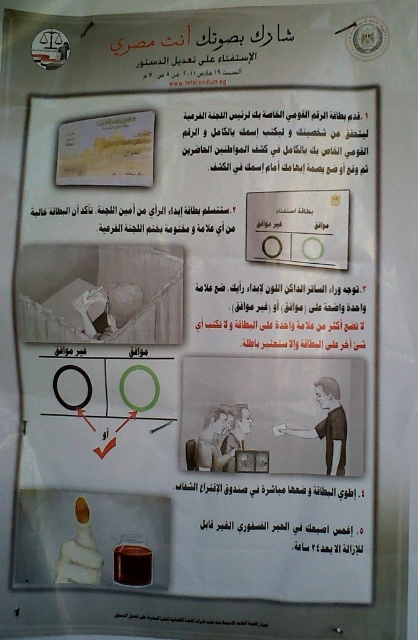
Question: Is matte white text at upper center to the left of black paper at upper left from the viewer's perspective?

Choices:
 (A) no
 (B) yes

Answer: (A)

Question: Is black paper at lower center thinner than black paper at upper left?

Choices:
 (A) no
 (B) yes

Answer: (B)

Question: Which object appears farthest from the camera in this image?

Choices:
 (A) white paper at upper center
 (B) black paper at center

Answer: (A)

Question: Is matte white text at upper center closer to the viewer compared to black paper at center?

Choices:
 (A) yes
 (B) no

Answer: (B)

Question: Estimate the real-world distances between objects in this image. Which object is farther from the matte white text at upper center?

Choices:
 (A) black paper at lower center
 (B) black paper at center

Answer: (A)

Question: Considering the real-world distances, which object is farthest from the matte white text at upper center?

Choices:
 (A) black paper at upper left
 (B) white paper at upper center

Answer: (A)